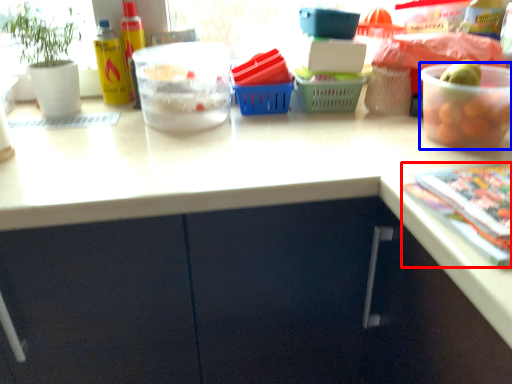
Question: Which point is closer to the camera, magazine (highlighted by a red box) or bowl (highlighted by a blue box)?

Choices:
 (A) magazine
 (B) bowl

Answer: (A)